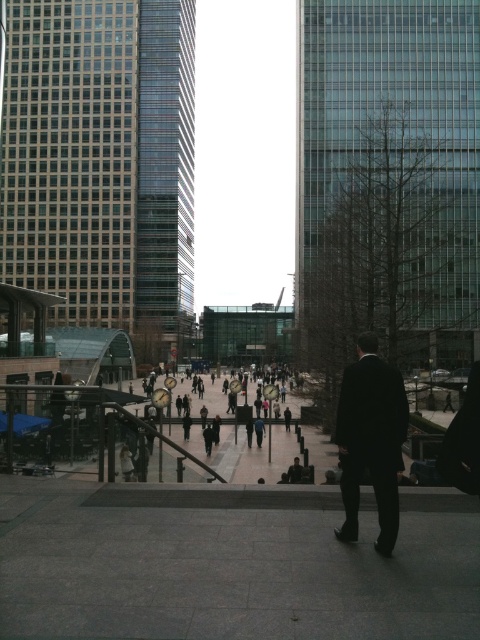
Question: Which of the following is the closest to the observer?

Choices:
 (A) gray concrete pavement at center
 (B) black suit at center

Answer: (A)

Question: Does gray concrete pavement at center appear over black suit at center?

Choices:
 (A) no
 (B) yes

Answer: (A)

Question: Among these objects, which one is nearest to the camera?

Choices:
 (A) gray concrete pavement at center
 (B) black suit at center

Answer: (A)

Question: Can you confirm if gray concrete pavement at center is positioned above black suit at center?

Choices:
 (A) yes
 (B) no

Answer: (B)

Question: Among these objects, which one is nearest to the camera?

Choices:
 (A) black suit at center
 (B) gray concrete pavement at center

Answer: (B)

Question: Considering the relative positions of gray concrete pavement at center and black suit at center in the image provided, where is gray concrete pavement at center located with respect to black suit at center?

Choices:
 (A) right
 (B) left

Answer: (B)